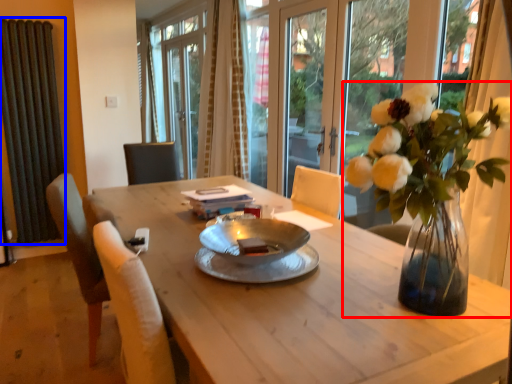
Question: Which of the following is the farthest to the observer, houseplant (highlighted by a red box) or radiator (highlighted by a blue box)?

Choices:
 (A) houseplant
 (B) radiator

Answer: (B)